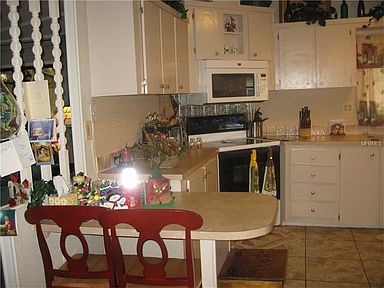
Locate an element on the screen. The width and height of the screenshot is (384, 288). white microwave is located at coordinates (258, 70).